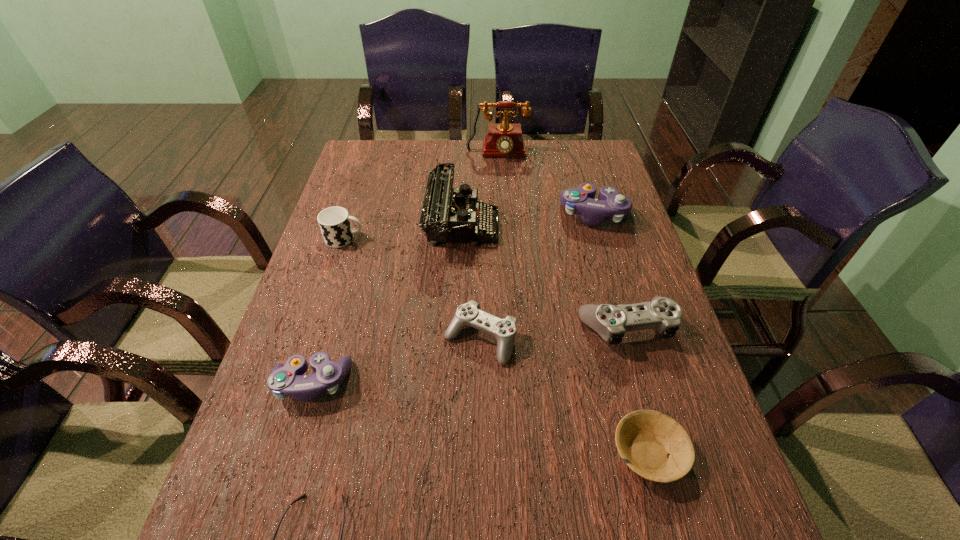
Locate an element on the screen. The width and height of the screenshot is (960, 540). telephone is located at coordinates (503, 140).

Image resolution: width=960 pixels, height=540 pixels. Identify the location of the farthest object. (503, 140).

This screenshot has height=540, width=960. What are the coordinates of `typewriter` in the screenshot? It's located at (449, 214).

Identify the location of the tallest control. (610, 205).

Identify the location of the right purple control. This screenshot has width=960, height=540. (610, 205).

Find the location of a particular element. cup is located at coordinates (334, 222).

At what (x,y) coordinates should I click in order to perform the action: click on the right white control. Please return your answer as a coordinate pair (x, y). The image size is (960, 540). Looking at the image, I should click on (611, 322).

The image size is (960, 540). In order to click on the smaller purple control in this screenshot , I will do `click(285, 380)`.

Identify the location of the nearer purple control. Image resolution: width=960 pixels, height=540 pixels. (285, 380).

You are a GUI agent. You are given a task and a screenshot of the screen. Output one action in this format:
    pyautogui.click(x=<x>, y=<y>)
    Task: Click on the seventh tallest object
    Image resolution: width=960 pixels, height=540 pixels.
    Given the screenshot: What is the action you would take?
    pyautogui.click(x=468, y=314)